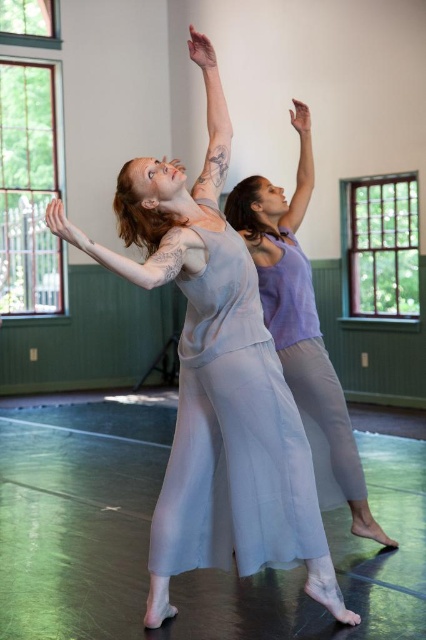
Question: Which is nearer to the matte purple arm at upper center?

Choices:
 (A) matte gray dress at center
 (B) matte lavender dress at center
 (C) matte gray arm at upper center
 (D) matte gray arm at upper left

Answer: (B)

Question: Observing the image, what is the correct spatial positioning of matte gray dress at center in reference to matte purple arm at upper center?

Choices:
 (A) above
 (B) below

Answer: (B)

Question: Is matte lavender dress at center closer to the viewer compared to matte gray arm at upper center?

Choices:
 (A) no
 (B) yes

Answer: (A)

Question: From the image, what is the correct spatial relationship of matte lavender dress at center in relation to matte gray arm at upper center?

Choices:
 (A) right
 (B) left

Answer: (A)

Question: Among these points, which one is nearest to the camera?

Choices:
 (A) (94, 253)
 (B) (226, 161)
 (C) (238, 184)

Answer: (A)

Question: Which object is closer to the camera taking this photo?

Choices:
 (A) matte purple arm at upper center
 (B) matte gray dress at center
 (C) matte gray arm at upper center
 (D) matte gray arm at upper left

Answer: (D)